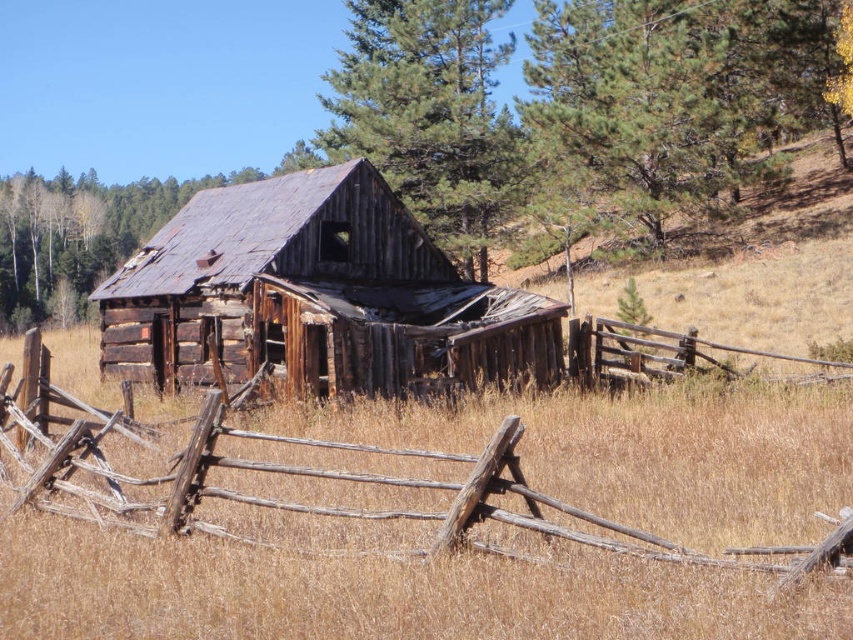
Who is more forward, (822, 116) or (132, 509)?

Point (132, 509) is more forward.

Who is positioned more to the right, green textured pine tree at upper center or weathered wood fence at center?

green textured pine tree at upper center is more to the right.

What do you see at coordinates (577, 108) in the screenshot? The height and width of the screenshot is (640, 853). I see `green textured pine tree at upper center` at bounding box center [577, 108].

The width and height of the screenshot is (853, 640). In order to click on green textured pine tree at upper center in this screenshot , I will do `click(577, 108)`.

Based on the photo, does weathered wood fence at center have a larger size compared to green rough bark tree at upper center?

Actually, weathered wood fence at center might be smaller than green rough bark tree at upper center.

Is weathered wood fence at center closer to the viewer compared to green rough bark tree at upper center?

Yes, weathered wood fence at center is closer to the viewer.

Does point (64, 515) lie in front of point (416, 106)?

That is True.

I want to click on weathered wood fence at center, so [x=312, y=486].

Who is lower down, rusty wood barn at center or weathered wood fence at center?

weathered wood fence at center is lower down.

Where is `rusty wood barn at center`? This screenshot has height=640, width=853. rusty wood barn at center is located at coordinates (315, 298).

Does point (274, 269) come farther from viewer compared to point (596, 541)?

Yes, it is behind point (596, 541).

This screenshot has width=853, height=640. What are the coordinates of `rusty wood barn at center` in the screenshot? It's located at (315, 298).